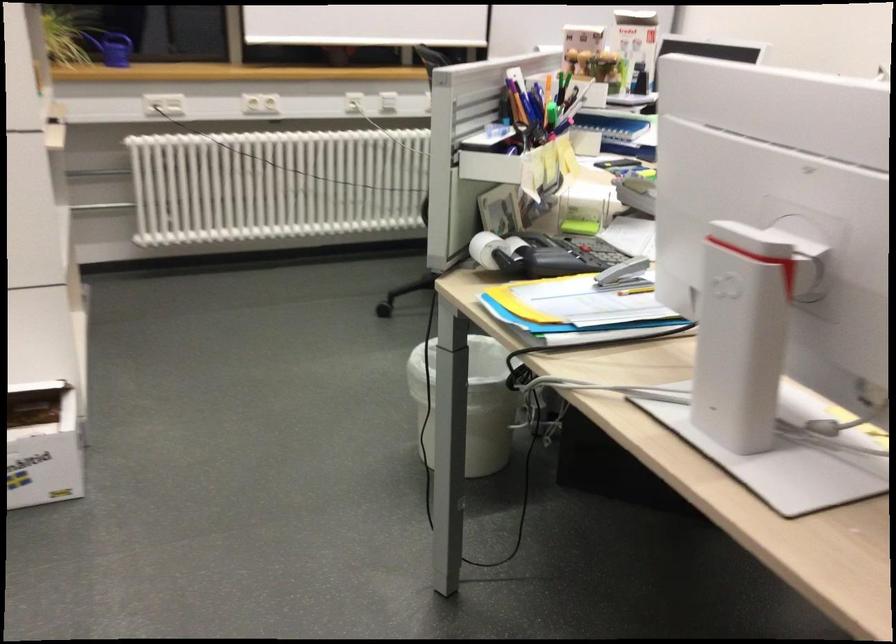
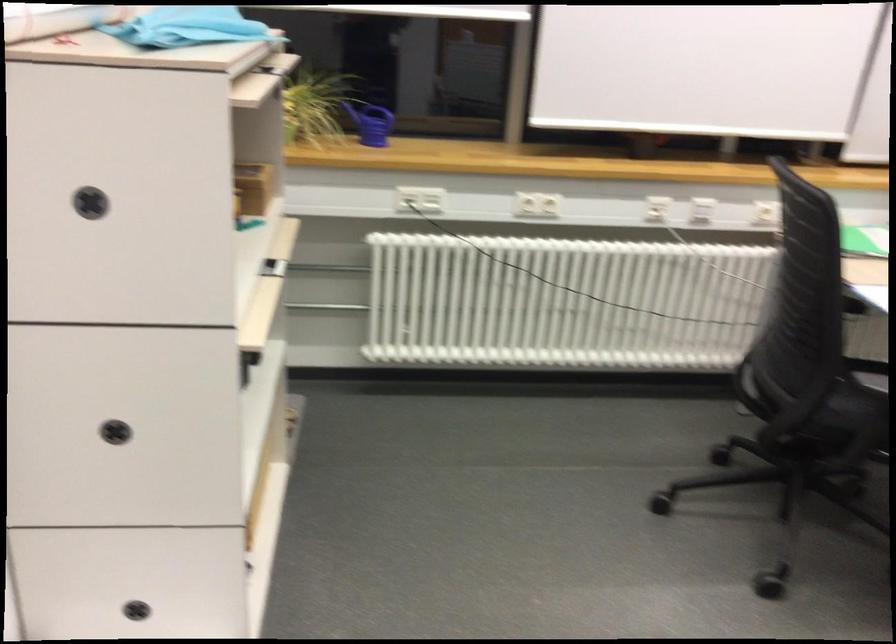
The point at (349, 98) is marked in the first image. Where is the corresponding point in the second image?

(657, 209)